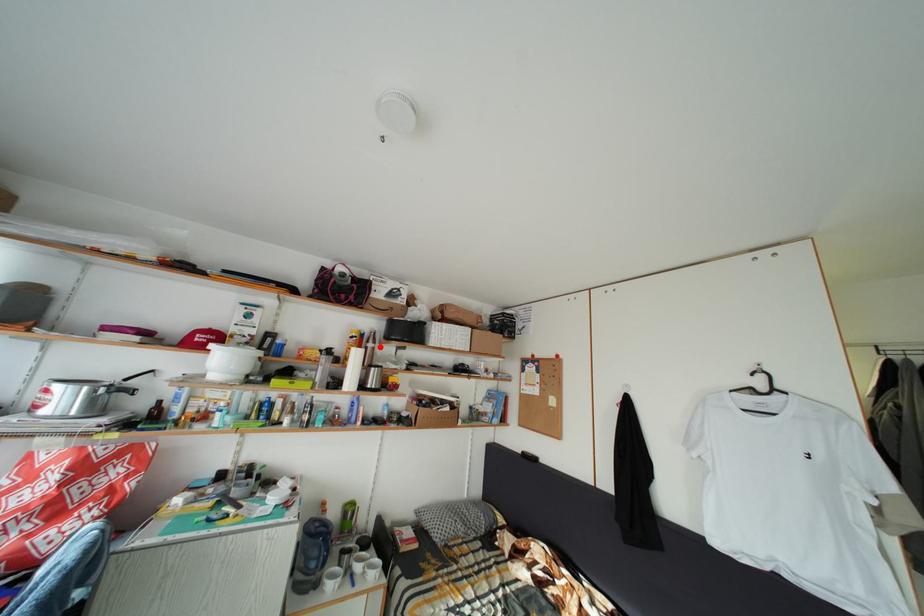
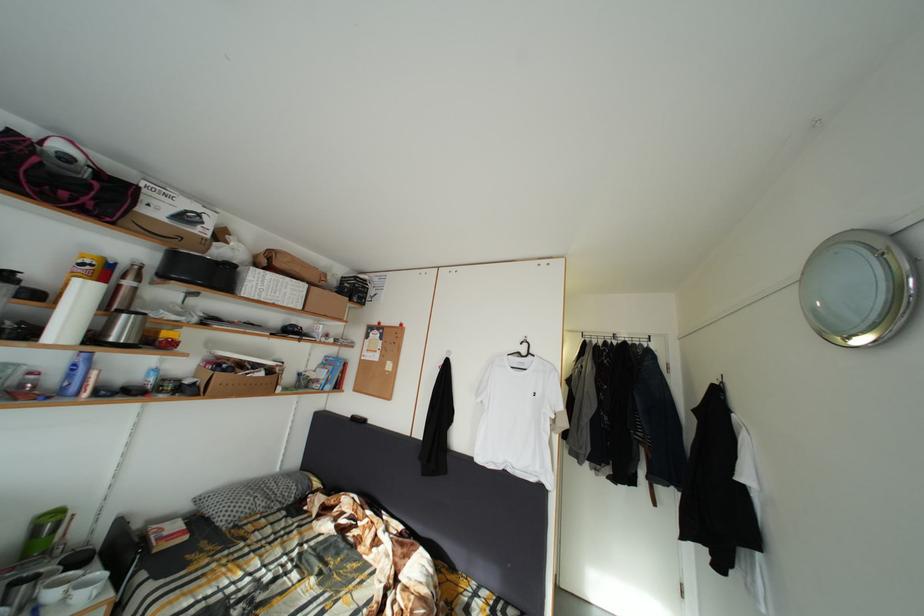
Locate, in the second image, the point that corresponds to the highlighted location in the first image.

(140, 283)